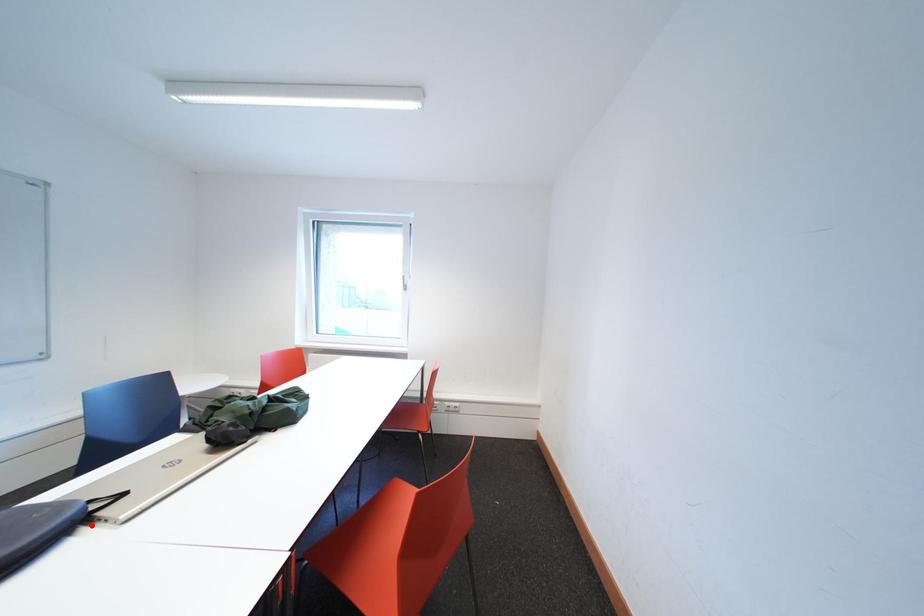
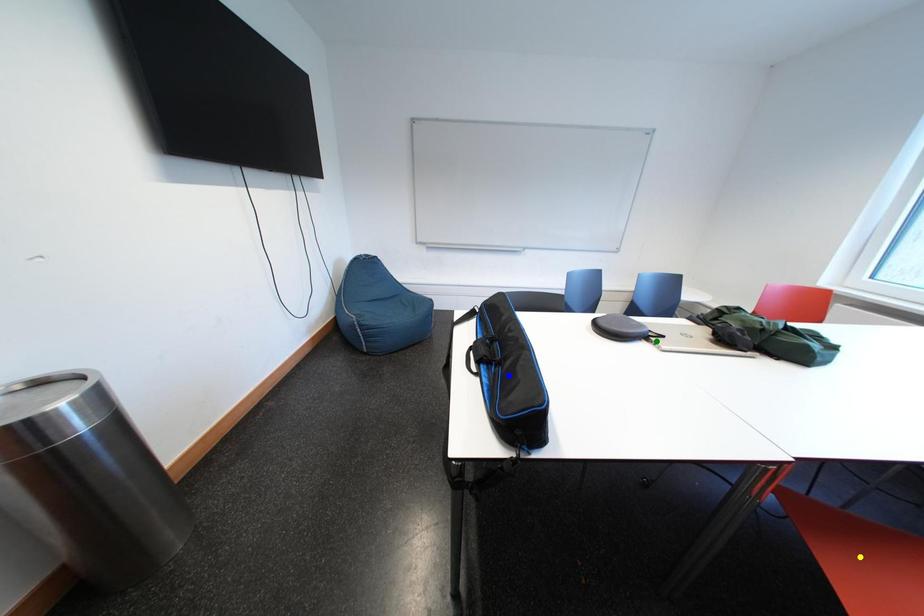
Question: I am providing you with two images of the same scene from different viewpoints. A red point is marked on the first image. You are given multiple points on the second image. Which mark in image 2 goes with the point in image 1?

Choices:
 (A) green point
 (B) yellow point
 (C) blue point

Answer: (A)